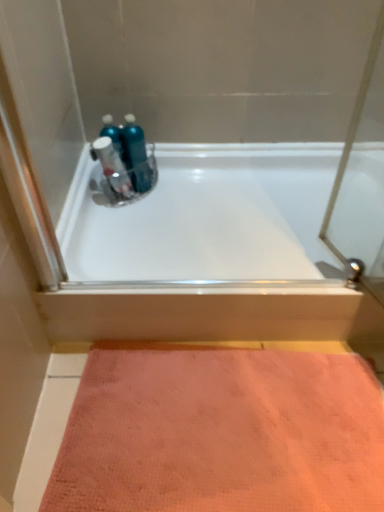
At what (x,y) coordinates should I click in order to perform the action: click on spots to the right of blue glossy mouthwash at center. Please return your answer as a coordinate pair (x, y). Looking at the image, I should click on (192, 181).